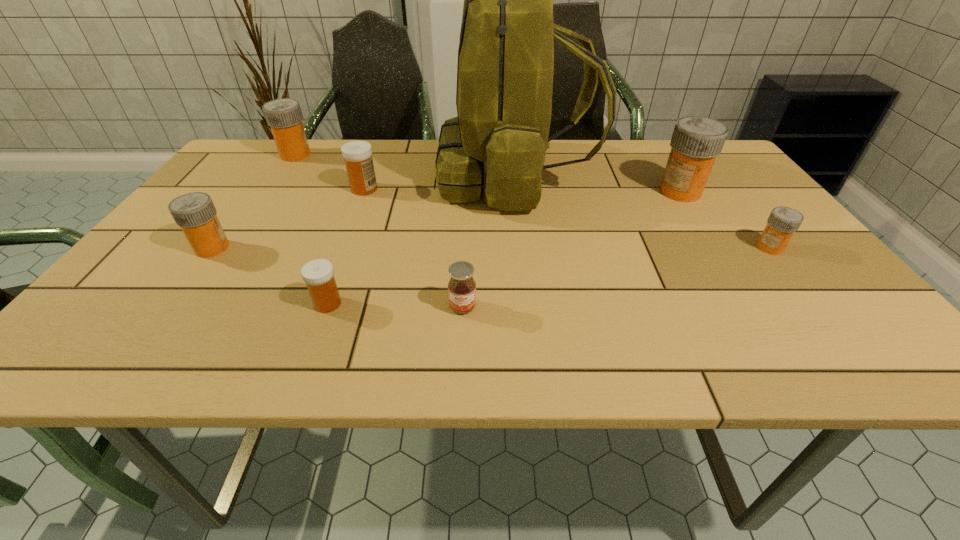
The height and width of the screenshot is (540, 960). I want to click on backpack, so click(x=506, y=51).

Identify the location of the third nearest orange medicine. The height and width of the screenshot is (540, 960). (696, 141).

Find the location of a particular element. The image size is (960, 540). the second object from right to left is located at coordinates (696, 141).

Identify the location of the third smallest orange medicine. (284, 116).

Image resolution: width=960 pixels, height=540 pixels. I want to click on the farthest medicine, so click(284, 116).

Find the location of a particular element. This screenshot has width=960, height=540. the third biggest orange medicine is located at coordinates (195, 213).

Identify the location of the farther white medicine. The image size is (960, 540). (357, 154).

At what (x,y) coordinates should I click in order to perform the action: click on jam. Please return your answer as a coordinate pair (x, y). Image resolution: width=960 pixels, height=540 pixels. Looking at the image, I should click on (461, 287).

Where is `the rightmost orange medicine`? The image size is (960, 540). the rightmost orange medicine is located at coordinates (x=782, y=222).

Find the location of a particular element. The height and width of the screenshot is (540, 960). the smallest orange medicine is located at coordinates (782, 222).